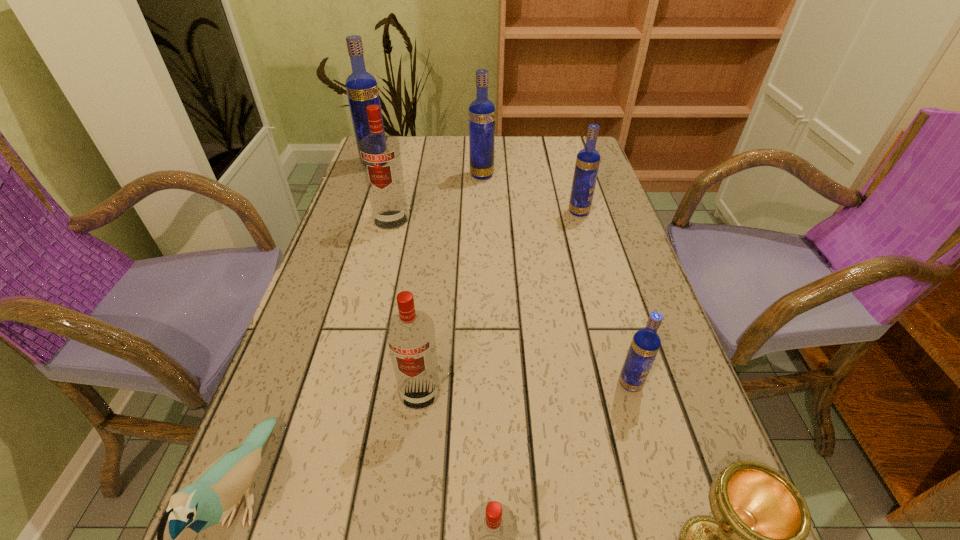
Find the location of `blue vodka that is the third nearest to the nearest red vodka`. blue vodka that is the third nearest to the nearest red vodka is located at coordinates (481, 111).

Identify the location of the third closest blue vodka to the chalice. The height and width of the screenshot is (540, 960). (481, 111).

Select which red vodka appears as the third closest to the leftmost vodka. Please provide its 2D coordinates. Your answer should be formatted as a tuple, i.e. [(x, y)], where the tuple contains the x and y coordinates of a point satisfying the conditions above.

[(493, 528)]

You are a GUI agent. You are given a task and a screenshot of the screen. Output one action in this format:
    pyautogui.click(x=<x>, y=<y>)
    Task: Click on the red vodka that is the closest to the second smallest red vodka
    
    Given the screenshot: What is the action you would take?
    pyautogui.click(x=493, y=528)

This screenshot has height=540, width=960. I want to click on vacant area that satisfies the following two spatial constraints: 1. on the front side of the second biggest blue vodka; 2. on the right side of the nearest blue vodka, so [x=483, y=383].

At what (x,y) coordinates should I click in order to perform the action: click on vacant point that satisfies the following two spatial constraints: 1. on the front label of the leftmost red vodka; 2. on the right side of the nearest blue vodka. Please return your answer as a coordinate pair (x, y). The image size is (960, 540). Looking at the image, I should click on (349, 383).